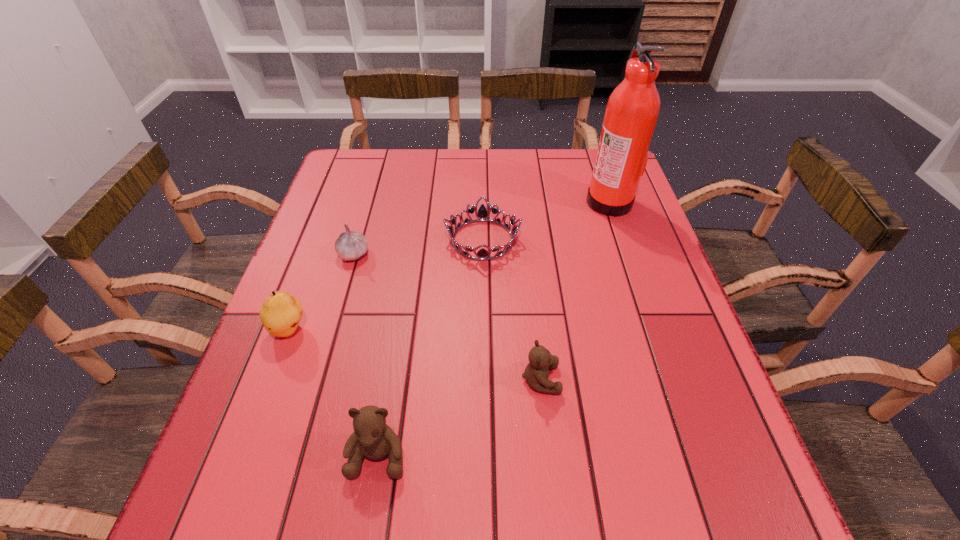
In order to click on free space between the tiara and the nearest object in this screenshot , I will do `click(430, 347)`.

This screenshot has height=540, width=960. What are the coordinates of `unoccupied position between the fire extinguisher and the left teddy bear` in the screenshot? It's located at (493, 328).

Where is `object that is the fifth nearest to the left teddy bear`? The width and height of the screenshot is (960, 540). object that is the fifth nearest to the left teddy bear is located at coordinates (632, 110).

Identify which object is located as the fourth nearest to the shorter teddy bear. Please provide its 2D coordinates. Your answer should be formatted as a tuple, i.e. [(x, y)], where the tuple contains the x and y coordinates of a point satisfying the conditions above.

[(351, 245)]

Locate an element on the screen. vacant space that satisfies the following two spatial constraints: 1. on the front-facing side of the shortest object; 2. on the front-facing side of the taller teddy bear is located at coordinates (484, 454).

The height and width of the screenshot is (540, 960). What are the coordinates of `free space that satisfies the following two spatial constraints: 1. on the label side of the tallest object; 2. on the front-facing side of the fourth object from right to left` in the screenshot? It's located at (695, 454).

Identify the location of vacant point that satisfies the following two spatial constraints: 1. on the label side of the fire extinguisher; 2. on the front-facing side of the left teddy bear. Image resolution: width=960 pixels, height=540 pixels. (x=695, y=454).